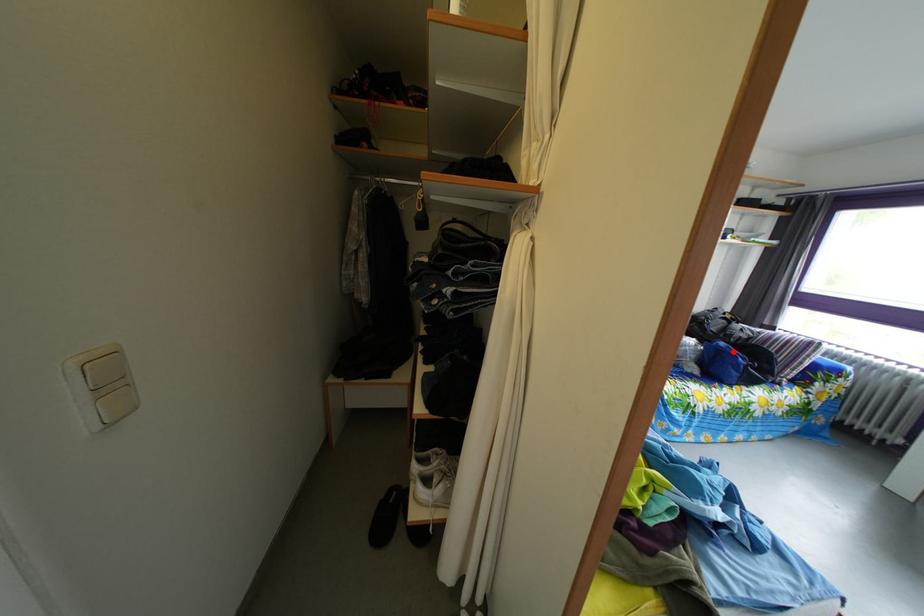
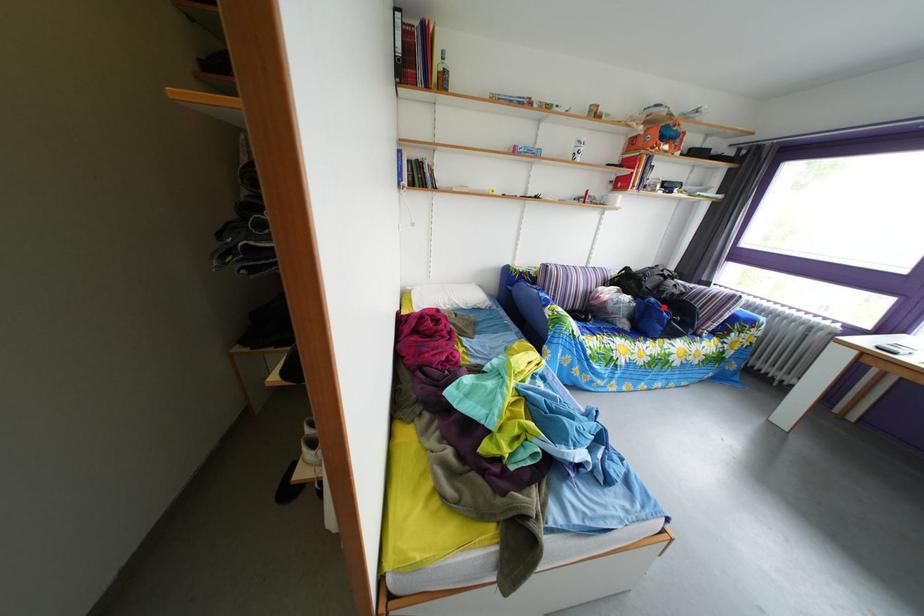
I am providing you with two images of the same scene from different viewpoints. A red point is marked on the first image and another point is marked on the second image. Do the highlighted points in image1 and image2 indicate the same real-world spot?

Yes